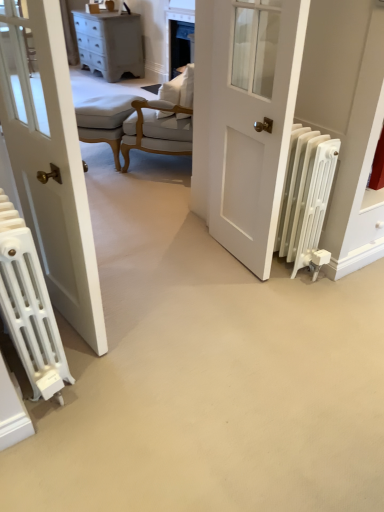
Question: Does white matte door at center appear on the left side of light beige fabric stool at center?

Choices:
 (A) yes
 (B) no

Answer: (B)

Question: From the image's perspective, is white matte door at center on top of light beige fabric stool at center?

Choices:
 (A) no
 (B) yes

Answer: (A)

Question: Is white matte door at center aimed at light beige fabric stool at center?

Choices:
 (A) yes
 (B) no

Answer: (B)

Question: Is white matte door at center beside light beige fabric stool at center?

Choices:
 (A) yes
 (B) no

Answer: (B)

Question: Considering the relative sizes of white matte door at center and light beige fabric stool at center in the image provided, is white matte door at center taller than light beige fabric stool at center?

Choices:
 (A) no
 (B) yes

Answer: (B)

Question: From a real-world perspective, is white matte door at center under light beige fabric stool at center?

Choices:
 (A) no
 (B) yes

Answer: (A)

Question: From a real-world perspective, does white matte radiator at right, placed as the 1th radiator when sorted from right to left, sit lower than white fabric chair at center?

Choices:
 (A) yes
 (B) no

Answer: (A)

Question: Can you confirm if white matte radiator at right, placed as the 1th radiator when sorted from right to left, is shorter than white fabric chair at center?

Choices:
 (A) yes
 (B) no

Answer: (A)

Question: Is white matte radiator at right, which is the second radiator in left-to-right order, thinner than white fabric chair at center?

Choices:
 (A) yes
 (B) no

Answer: (A)

Question: Is white matte radiator at right, placed as the 1th radiator when sorted from right to left, positioned behind white fabric chair at center?

Choices:
 (A) yes
 (B) no

Answer: (B)

Question: Are white matte radiator at right, placed as the 1th radiator when sorted from right to left, and white fabric chair at center making contact?

Choices:
 (A) yes
 (B) no

Answer: (B)

Question: Can you confirm if white matte radiator at right, placed as the 1th radiator when sorted from right to left, is bigger than white fabric chair at center?

Choices:
 (A) yes
 (B) no

Answer: (B)

Question: Does light beige fabric stool at center have a larger size compared to white fabric chair at center?

Choices:
 (A) no
 (B) yes

Answer: (A)